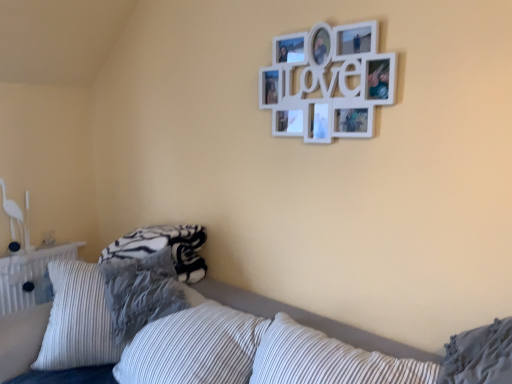
Question: Is textured gray pillow at lower left, which ranks as the first pillow in left-to-right order, to the left of white striped pillow at lower right, arranged as the first pillow when viewed from the right, from the viewer's perspective?

Choices:
 (A) no
 (B) yes

Answer: (B)

Question: Is textured gray pillow at lower left, arranged as the first pillow when viewed from the back, far away from white striped pillow at lower right, arranged as the first pillow when viewed from the right?

Choices:
 (A) yes
 (B) no

Answer: (A)

Question: From the image's perspective, is textured gray pillow at lower left, which ranks as the first pillow in left-to-right order, located beneath white striped pillow at lower right, acting as the first pillow starting from the front?

Choices:
 (A) no
 (B) yes

Answer: (B)

Question: Can you confirm if textured gray pillow at lower left, arranged as the first pillow when viewed from the back, is positioned to the right of white striped pillow at lower right, acting as the first pillow starting from the front?

Choices:
 (A) no
 (B) yes

Answer: (A)

Question: Is textured gray pillow at lower left, acting as the second pillow starting from the right, next to white striped pillow at lower right, arranged as the first pillow when viewed from the right, and touching it?

Choices:
 (A) yes
 (B) no

Answer: (B)

Question: Does point (393, 89) appear closer or farther from the camera than point (463, 379)?

Choices:
 (A) closer
 (B) farther

Answer: (B)

Question: Is white matte picture frame at upper center inside or outside of white striped pillow at lower right, acting as the first pillow starting from the front?

Choices:
 (A) outside
 (B) inside

Answer: (A)

Question: From a real-world perspective, relative to white striped pillow at lower right, arranged as the first pillow when viewed from the right, is white matte picture frame at upper center vertically above or below?

Choices:
 (A) above
 (B) below

Answer: (A)

Question: From their relative heights in the image, would you say white matte picture frame at upper center is taller or shorter than white striped pillow at lower right, marked as the second pillow in a left-to-right arrangement?

Choices:
 (A) tall
 (B) short

Answer: (A)

Question: Is textured gray pillow at lower left, which ranks as the first pillow in left-to-right order, to the left or to the right of white matte picture frame at upper center in the image?

Choices:
 (A) right
 (B) left

Answer: (B)

Question: In terms of size, does textured gray pillow at lower left, which ranks as the first pillow in left-to-right order, appear bigger or smaller than white matte picture frame at upper center?

Choices:
 (A) big
 (B) small

Answer: (A)

Question: In terms of height, does textured gray pillow at lower left, which ranks as the first pillow in left-to-right order, look taller or shorter compared to white matte picture frame at upper center?

Choices:
 (A) tall
 (B) short

Answer: (B)

Question: Is textured gray pillow at lower left, arranged as the first pillow when viewed from the back, inside the boundaries of white matte picture frame at upper center, or outside?

Choices:
 (A) inside
 (B) outside

Answer: (B)

Question: Does point (130, 274) appear closer or farther from the camera than point (476, 369)?

Choices:
 (A) farther
 (B) closer

Answer: (A)

Question: From a real-world perspective, relative to white striped pillow at lower right, the second pillow in the back-to-front sequence, is textured gray pillow at lower left, acting as the second pillow starting from the right, vertically above or below?

Choices:
 (A) above
 (B) below

Answer: (B)